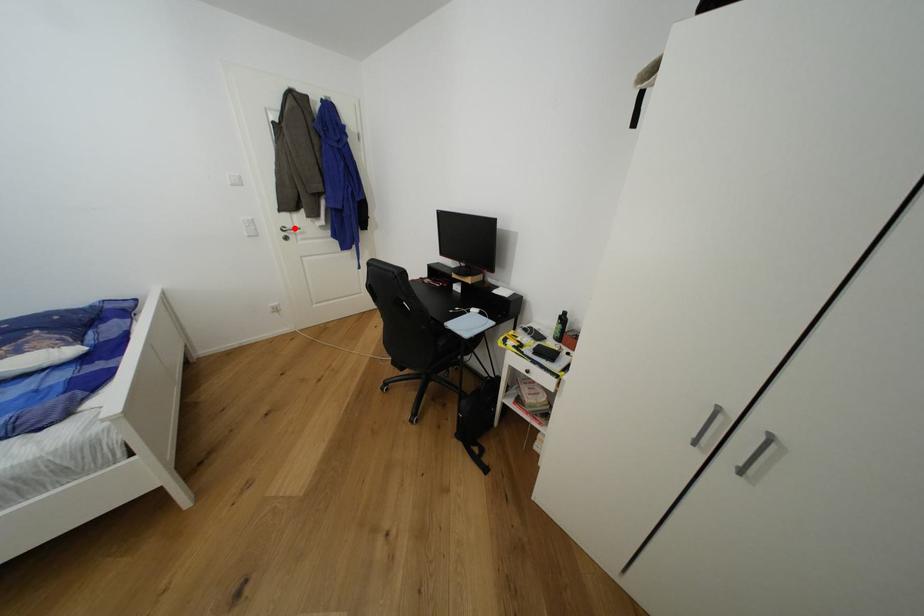
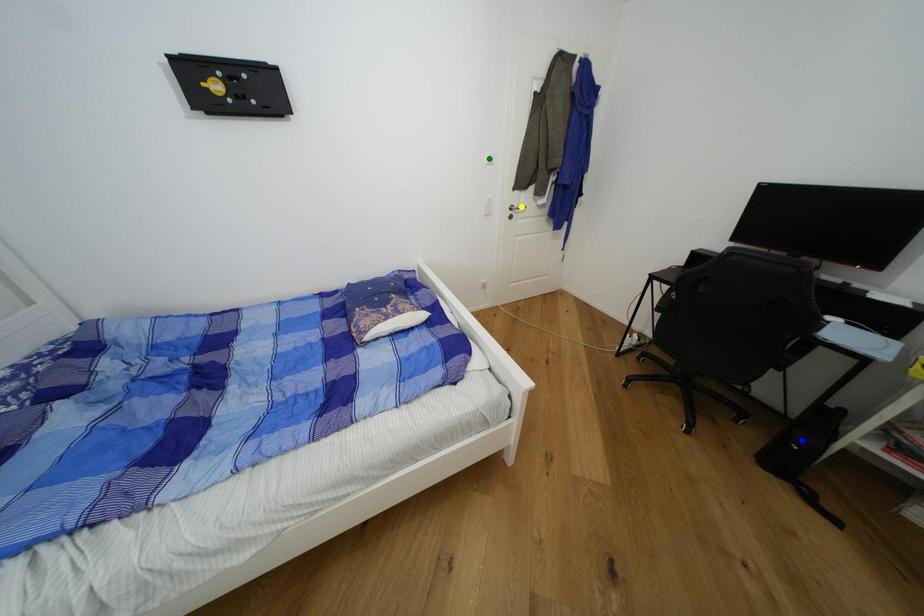
Question: I am providing you with two images of the same scene from different viewpoints. A red point is marked on the first image. You are given multiple points on the second image. Which mark in image 2 goes with the point in image 1?

Choices:
 (A) blue point
 (B) yellow point
 (C) green point

Answer: (B)